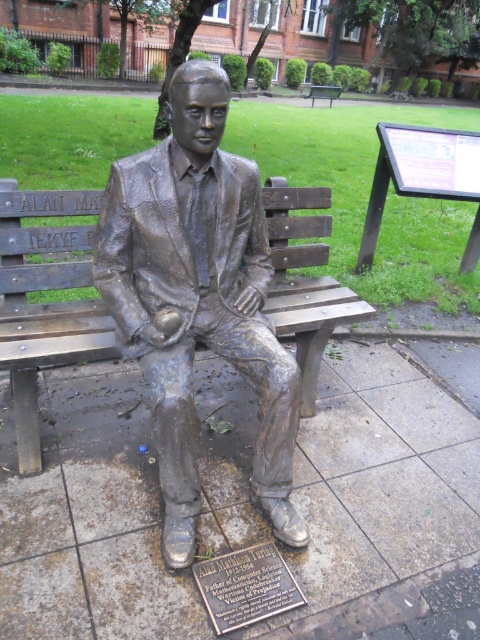
Question: Is bronze wood bench at center further to camera compared to brown wooden bench at center?

Choices:
 (A) yes
 (B) no

Answer: (B)

Question: Which object appears farthest from the camera in this image?

Choices:
 (A) bronze wood bench at center
 (B) bronze statue at center
 (C) bronze plaque at center
 (D) brown wooden bench at center

Answer: (D)

Question: Which of the following is the farthest from the observer?

Choices:
 (A) (313, 100)
 (B) (254, 618)

Answer: (A)

Question: Which object is positioned closest to the bronze wood bench at center?

Choices:
 (A) bronze plaque at center
 (B) bronze statue at center

Answer: (B)

Question: Observing the image, what is the correct spatial positioning of bronze plaque at center in reference to brown wooden bench at center?

Choices:
 (A) above
 (B) below

Answer: (B)

Question: Observing the image, what is the correct spatial positioning of bronze wood bench at center in reference to bronze plaque at center?

Choices:
 (A) below
 (B) above

Answer: (B)